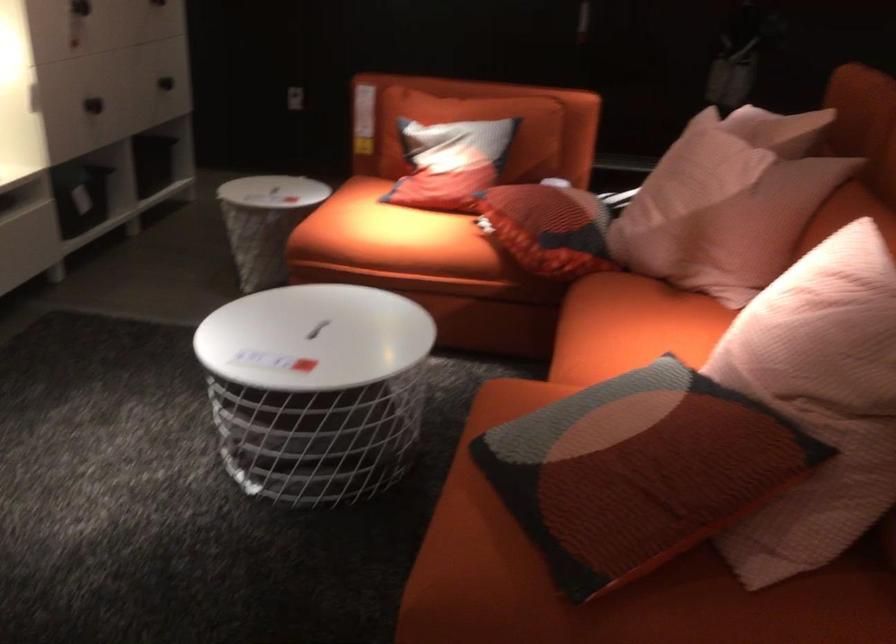
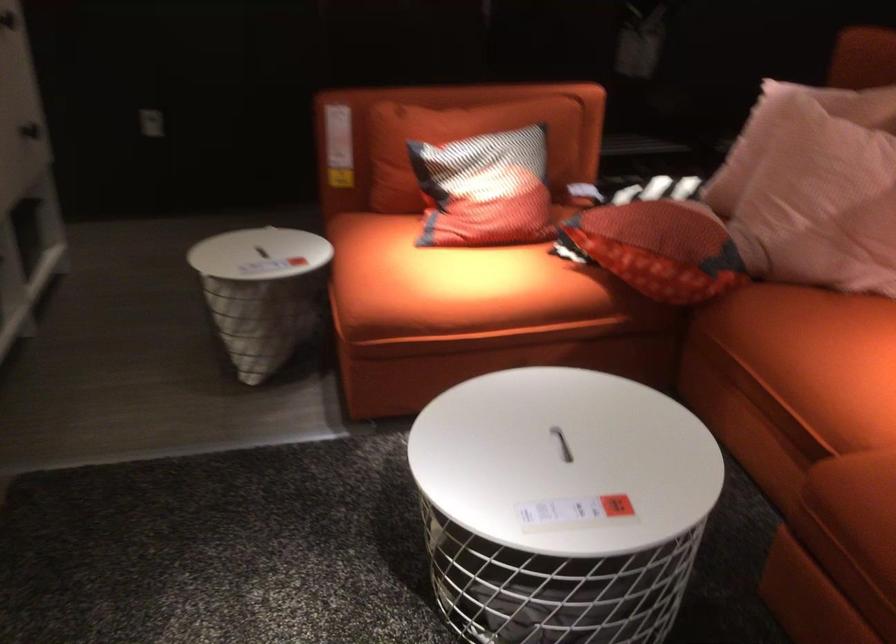
Which direction would the cameraman need to move to produce the second image?

The cameraman walked toward left, forward.